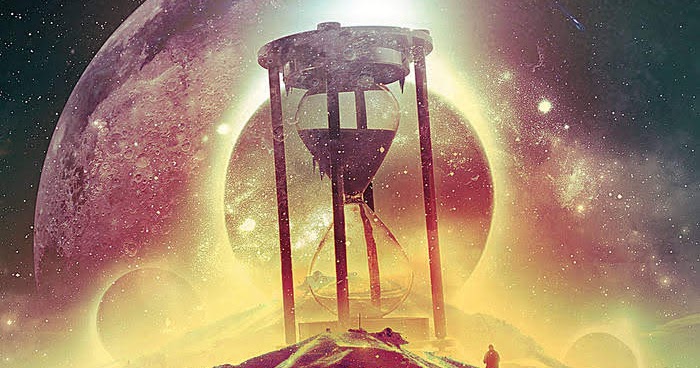
The image size is (700, 368). In order to click on light in this screenshot , I will do `click(217, 240)`, `click(474, 117)`.